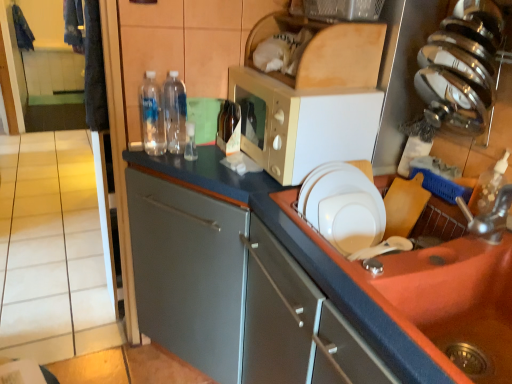
The height and width of the screenshot is (384, 512). I want to click on vacant region to the left of brown glass bottle at center, which appears as the third bottle when viewed from the left, so point(203,148).